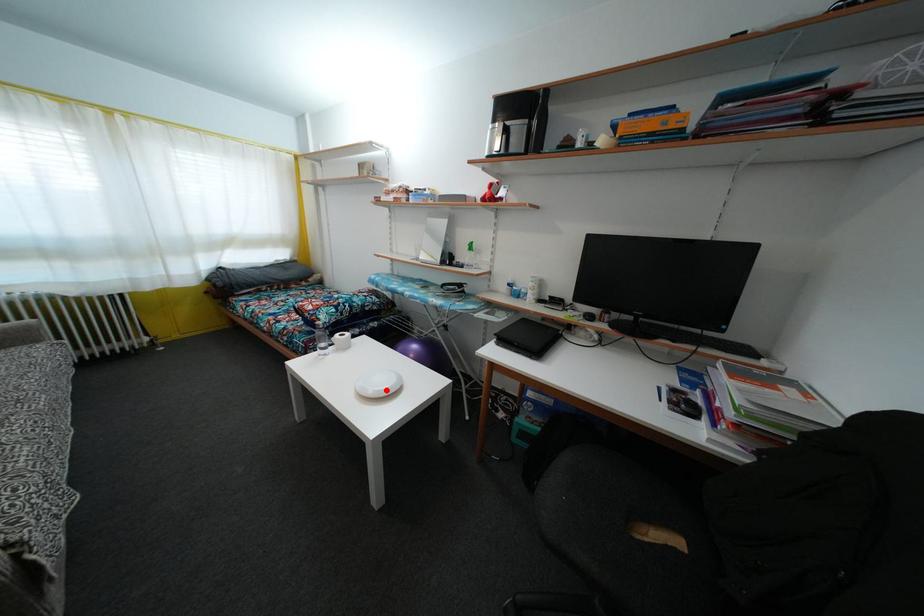
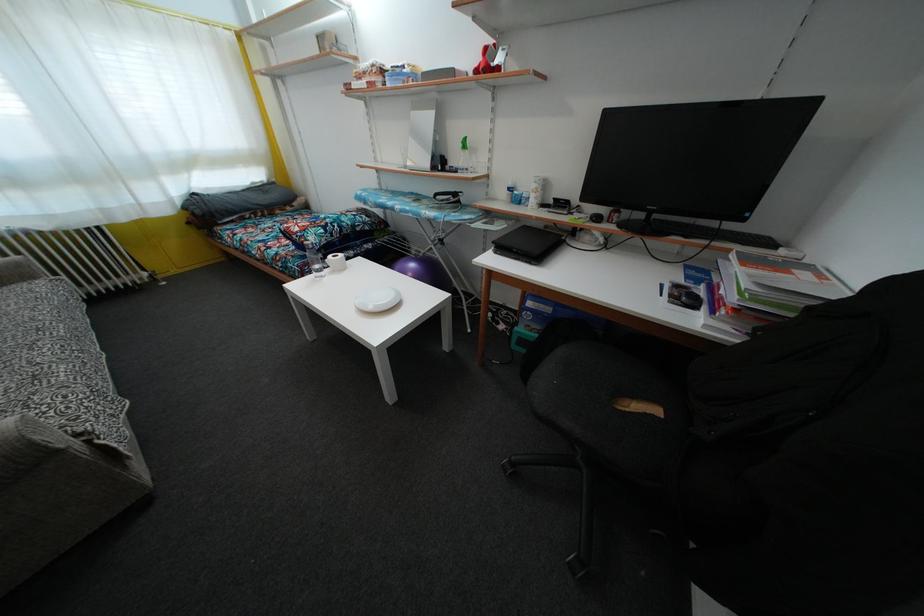
The point at the highlighted location is marked in the first image. Where is the corresponding point in the second image?

(385, 306)